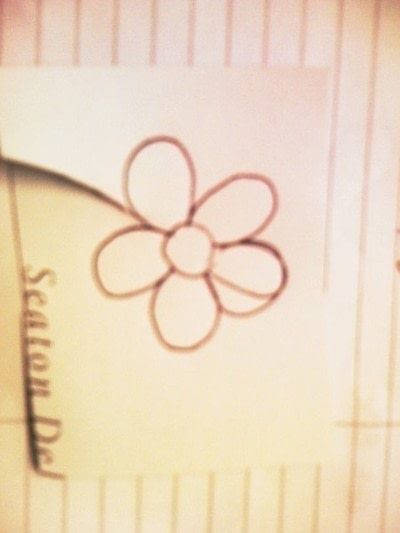
At what (x,y) coordinates should I click in order to perform the action: click on flower center. Please return your answer as a coordinate pair (x, y). This screenshot has width=400, height=533. Looking at the image, I should click on (186, 248).